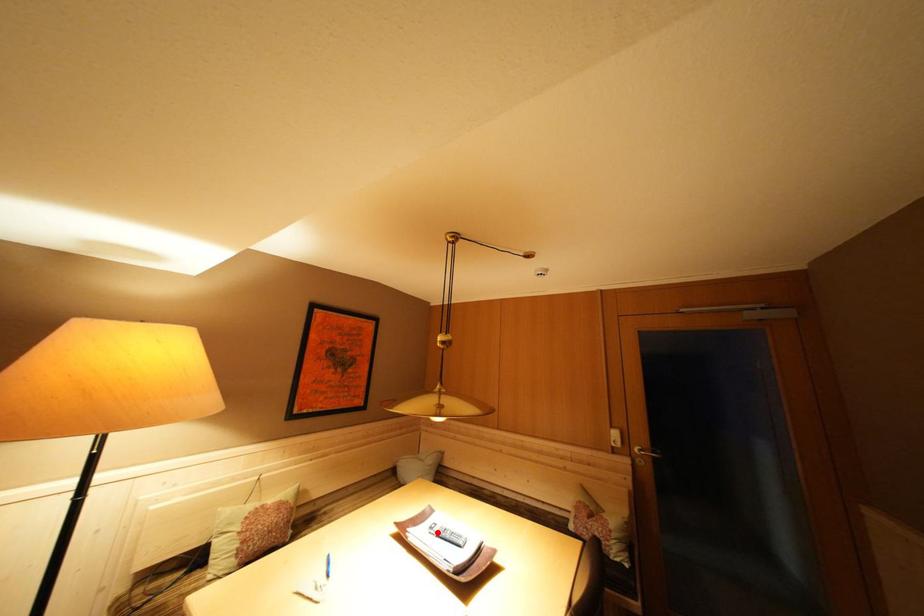
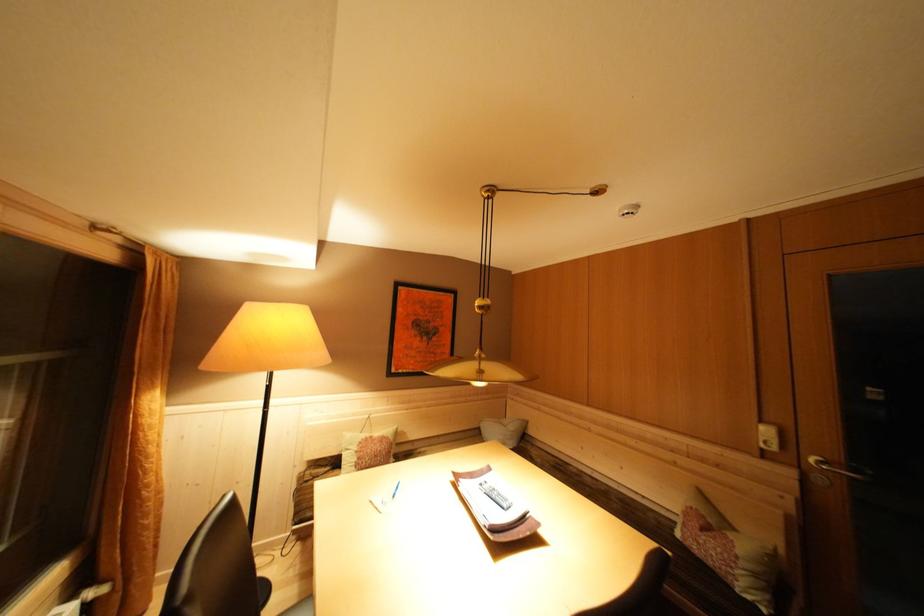
Where in the second image is the point corresponding to the highlighted location from the first image?

(488, 488)